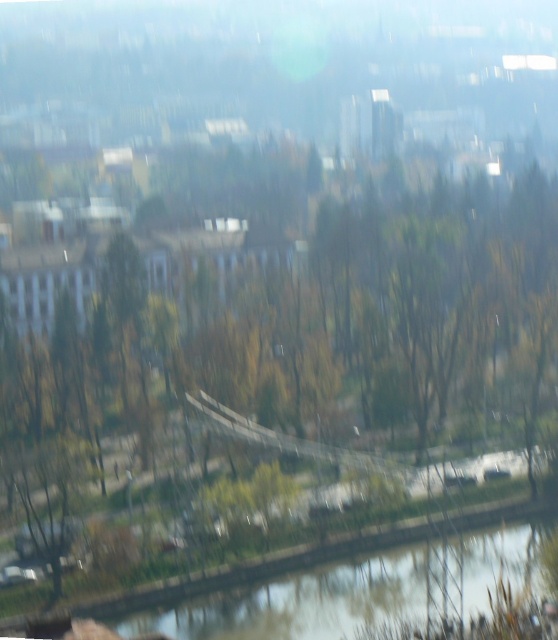
Question: Which of the following is the farthest from the observer?

Choices:
 (A) (484, 582)
 (B) (472, 300)

Answer: (B)

Question: Which object is farther from the camera taking this photo?

Choices:
 (A) brown leafy tree at center
 (B) green grassy river at bottom

Answer: (B)

Question: Is brown leafy tree at center further to camera compared to green grassy river at bottom?

Choices:
 (A) yes
 (B) no

Answer: (B)

Question: Can you confirm if brown leafy tree at center is positioned above green grassy river at bottom?

Choices:
 (A) no
 (B) yes

Answer: (B)

Question: Does brown leafy tree at center appear on the left side of green grassy river at bottom?

Choices:
 (A) no
 (B) yes

Answer: (B)